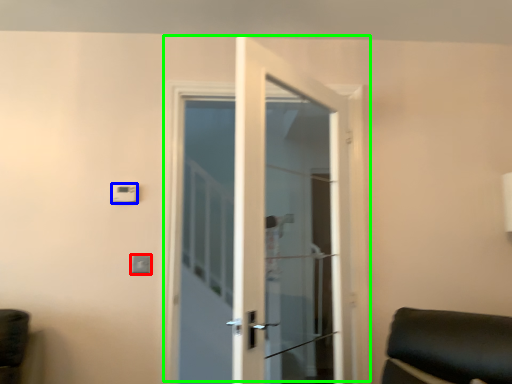
Question: Estimate the real-world distances between objects in this image. Which object is closer to light switch (highlighted by a red box), light switch (highlighted by a blue box) or door (highlighted by a green box)?

Choices:
 (A) light switch
 (B) door

Answer: (A)